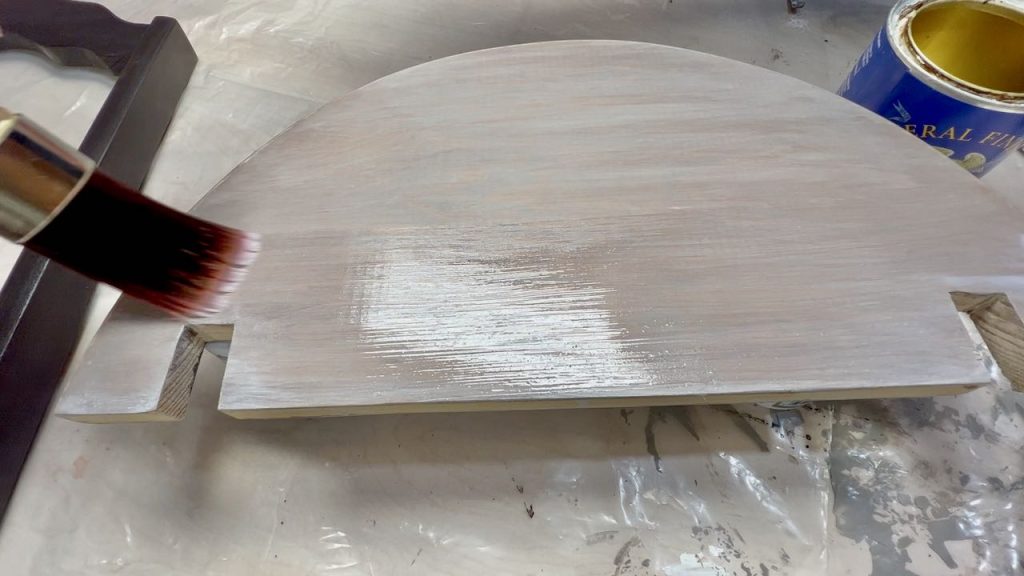
The height and width of the screenshot is (576, 1024). In order to click on 1/2 sleeve of dining room table in this screenshot , I will do `click(654, 353)`.